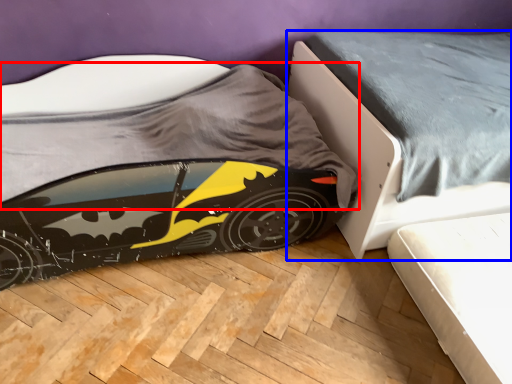
Question: Which object appears closest to the camera in this image, sheet (highlighted by a red box) or bed (highlighted by a blue box)?

Choices:
 (A) sheet
 (B) bed

Answer: (A)